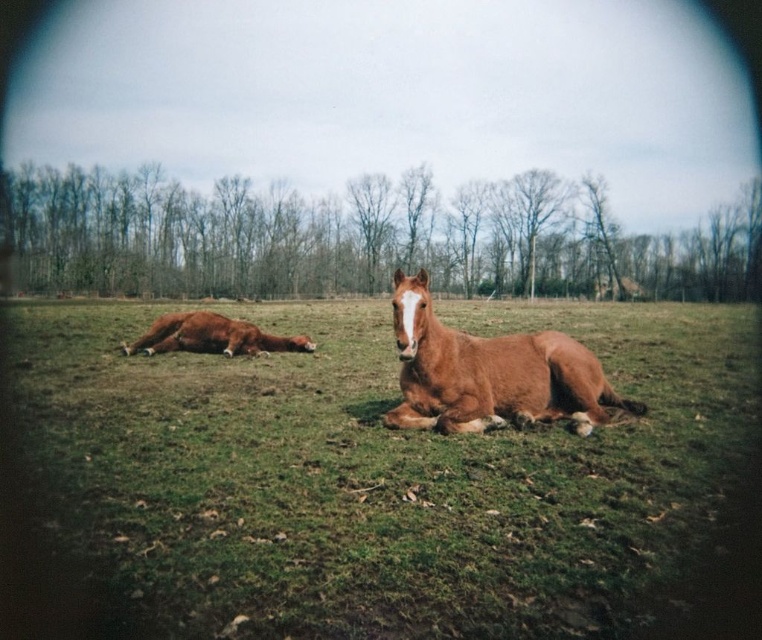
How distant is brown horse at center from brown glossy horse at center?

brown horse at center is 8.20 feet away from brown glossy horse at center.

Measure the distance between point (714,323) and camera.

20.60 meters

Who is more distant from viewer, (245, 404) or (492, 380)?

The point (245, 404) is more distant.

This screenshot has width=762, height=640. Identify the location of brown horse at center. (399, 480).